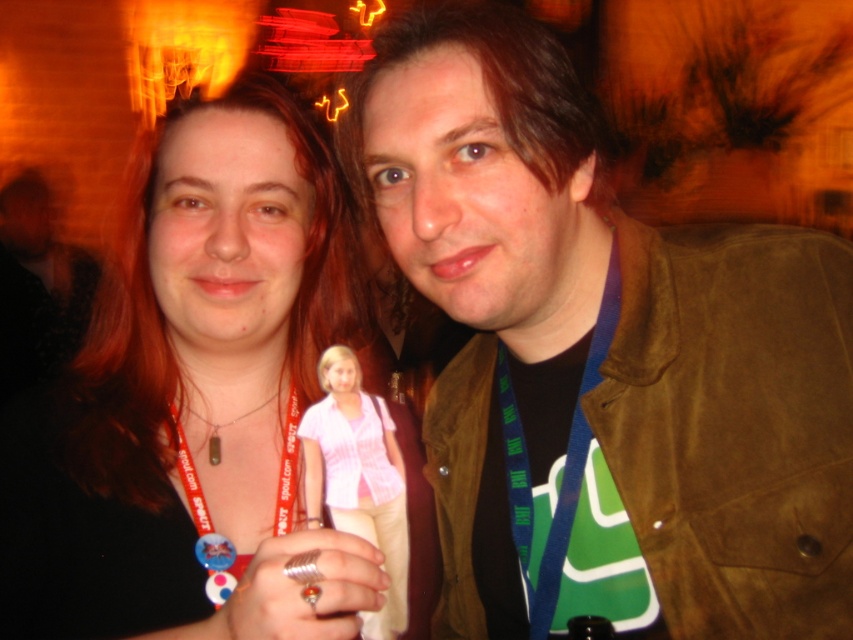
Question: Which of the following is the closest to the observer?

Choices:
 (A) pink fabric shirt at center
 (B) brown suede jacket at center
 (C) matte black necklace at center

Answer: (C)

Question: Which point is farther to the camera?

Choices:
 (A) pink fabric shirt at center
 (B) matte black necklace at center

Answer: (A)

Question: Can you confirm if matte black necklace at center is positioned above pink fabric shirt at center?

Choices:
 (A) yes
 (B) no

Answer: (A)

Question: Among these points, which one is nearest to the camera?

Choices:
 (A) (511, 214)
 (B) (280, 221)
 (C) (383, 436)

Answer: (A)

Question: Does brown suede jacket at center appear on the right side of pink fabric shirt at center?

Choices:
 (A) yes
 (B) no

Answer: (A)

Question: Can you confirm if matte black necklace at center is positioned below pink fabric shirt at center?

Choices:
 (A) no
 (B) yes

Answer: (A)